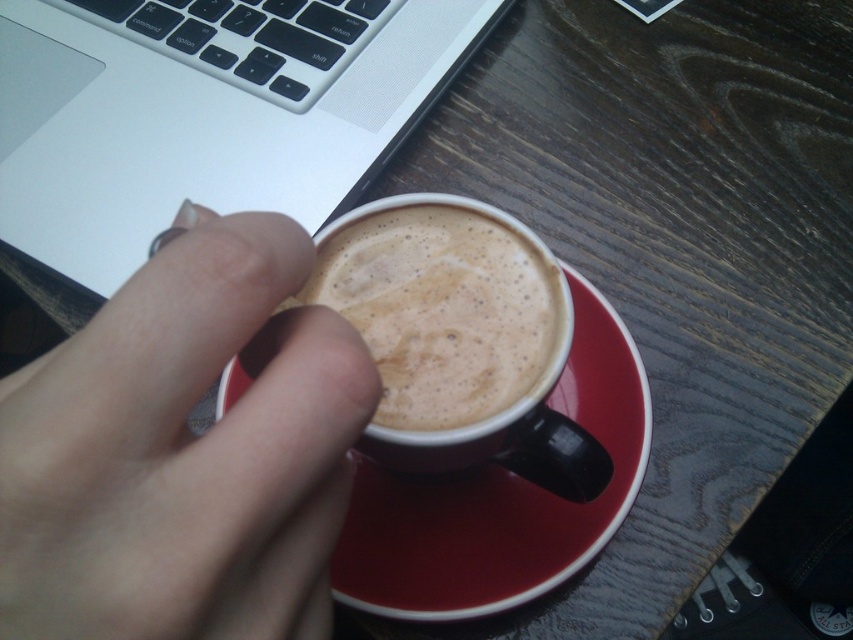
Question: Can you confirm if red matte saucer at center is positioned to the left of smooth matte coffee cup at center?

Choices:
 (A) no
 (B) yes

Answer: (A)

Question: Is red matte saucer at center closer to the viewer compared to smooth matte coffee cup at center?

Choices:
 (A) yes
 (B) no

Answer: (B)

Question: Considering the real-world distances, which object is closest to the silver metallic laptop at upper left?

Choices:
 (A) smooth matte coffee cup at center
 (B) smooth skin hand at upper center
 (C) red matte saucer at center

Answer: (C)

Question: Estimate the real-world distances between objects in this image. Which object is closer to the smooth matte coffee cup at center?

Choices:
 (A) silver metallic laptop at upper left
 (B) red matte saucer at center

Answer: (B)

Question: Estimate the real-world distances between objects in this image. Which object is farther from the silver metallic laptop at upper left?

Choices:
 (A) smooth matte coffee cup at center
 (B) smooth skin hand at upper center
 (C) red matte saucer at center

Answer: (B)

Question: Does smooth skin hand at upper center lie in front of red matte saucer at center?

Choices:
 (A) no
 (B) yes

Answer: (B)